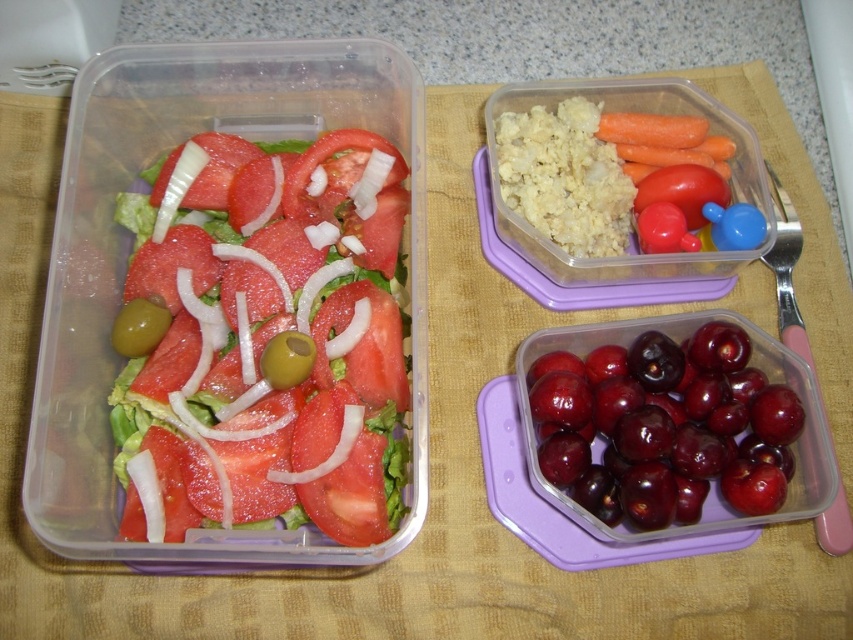
You are setting up a meal on a placemat and have two items, the sliced tomato salad at center and the green matte olive at left. Which one is located to the left of the other?

The green matte olive at left is located to the left of the sliced tomato salad at center.

You are a food delivery robot with a 12 inch wide tray. You need to place a new container between the sliced tomato salad at center and the shiny red cherries at lower right. Will your tray fit in the space between them?

The distance between the sliced tomato salad at center and the shiny red cherries at lower right is 10.29 inches. Since your tray is 12 inches wide, it will not fit in the space between them as the available space is narrower than the tray.